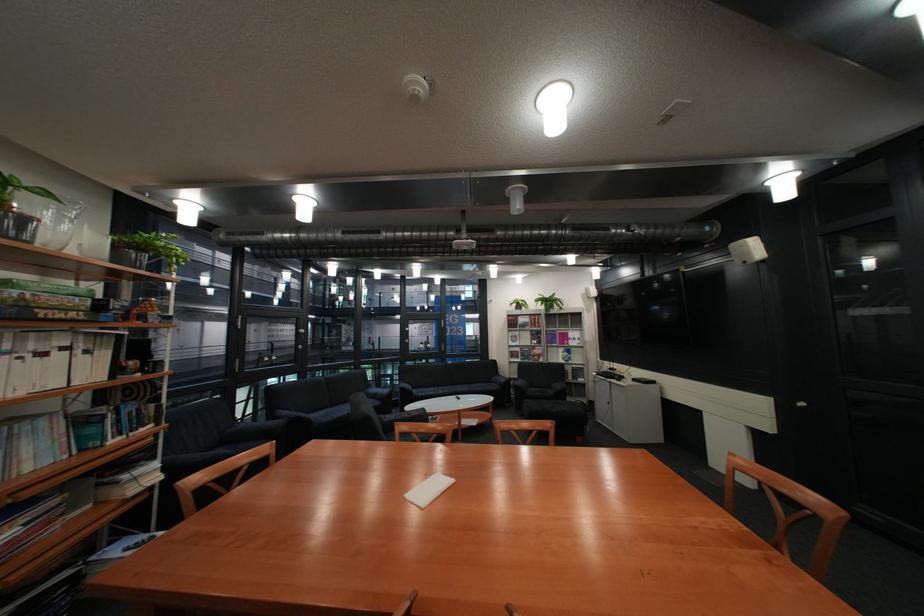
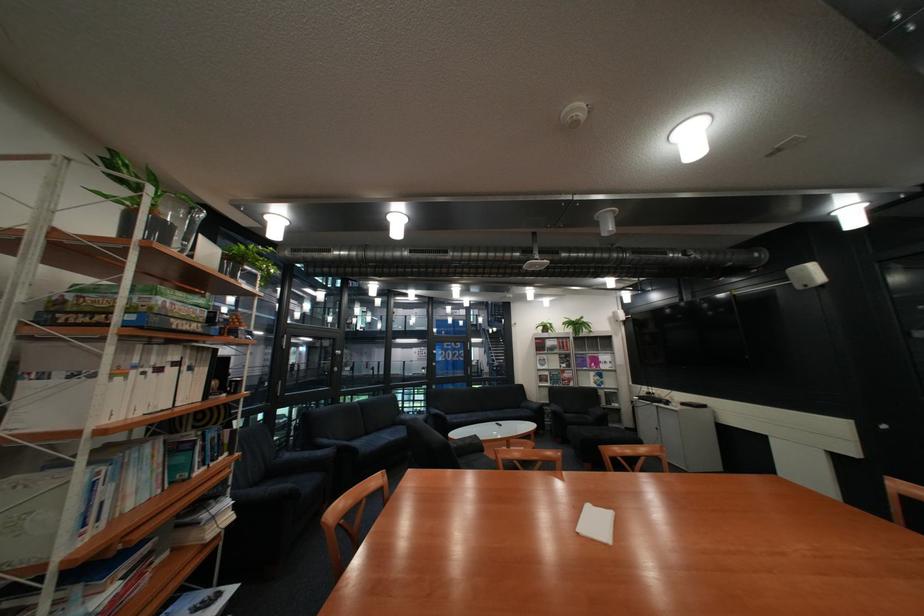
The point at (456, 392) is marked in the first image. Where is the corresponding point in the second image?

(490, 418)